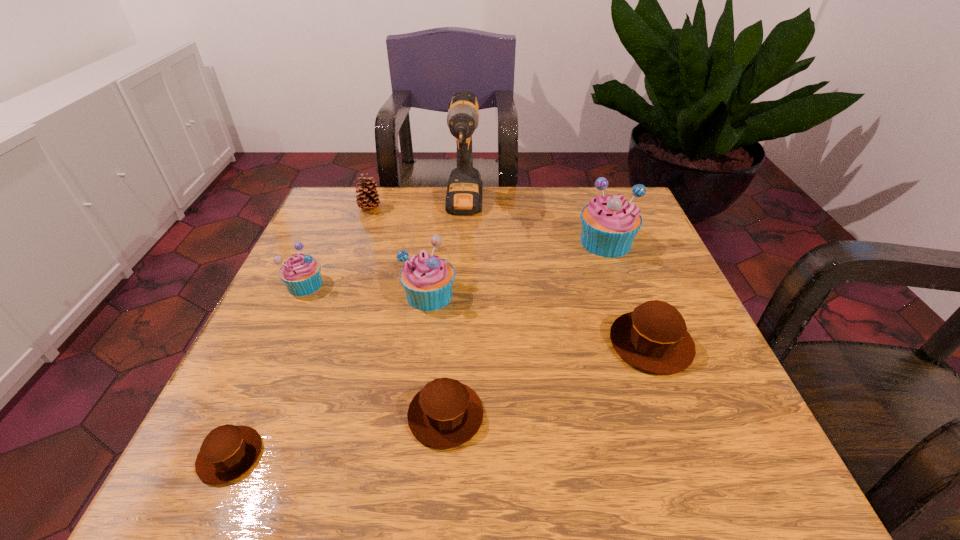
You are a GUI agent. You are given a task and a screenshot of the screen. Output one action in this format:
    pyautogui.click(x=<x>, y=<y>)
    Task: Click on the drill
    
    Given the screenshot: What is the action you would take?
    pyautogui.click(x=464, y=191)

In order to click on the farthest muffin in this screenshot , I will do `click(609, 224)`.

At what (x,y) coordinates should I click in order to perform the action: click on the farthest blue muffin. Please return your answer as a coordinate pair (x, y). This screenshot has width=960, height=540. Looking at the image, I should click on (609, 224).

The height and width of the screenshot is (540, 960). What are the coordinates of `the second blue muffin from left to right` in the screenshot? It's located at (427, 279).

Find the location of `the second smallest blue muffin`. the second smallest blue muffin is located at coordinates (427, 279).

Find the location of a particular element. The height and width of the screenshot is (540, 960). pinecone is located at coordinates (367, 199).

At what (x,y) coordinates should I click in order to perform the action: click on the leftmost blue muffin. Please return your answer as a coordinate pair (x, y). Image resolution: width=960 pixels, height=540 pixels. Looking at the image, I should click on (300, 273).

This screenshot has height=540, width=960. Identify the location of the third nearest object. (653, 337).

In order to click on the rightmost brown muffin in this screenshot , I will do `click(653, 337)`.

What are the coordinates of `the seventh tallest object` in the screenshot? It's located at (445, 414).